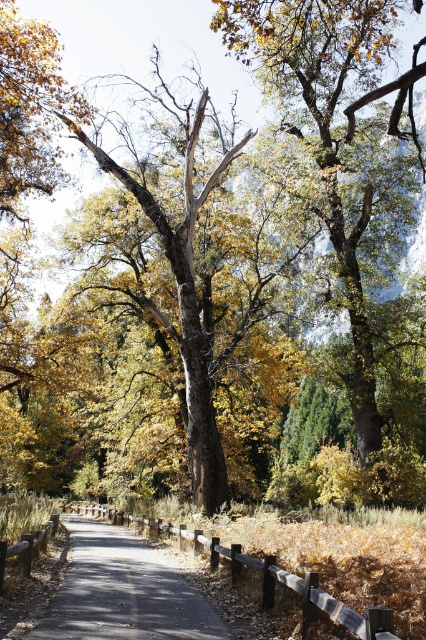
Can you confirm if green leafy tree at center is shorter than smooth asphalt path at center?

Incorrect, green leafy tree at center's height does not fall short of smooth asphalt path at center's.

Who is lower down, green leafy tree at center or smooth asphalt path at center?

smooth asphalt path at center

Locate an element on the screen. The height and width of the screenshot is (640, 426). green leafy tree at center is located at coordinates (333, 140).